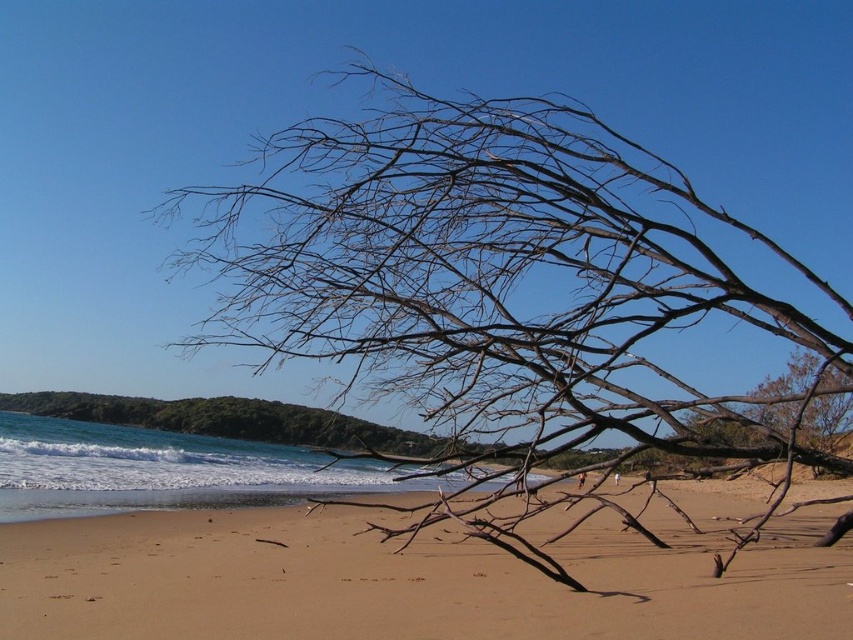
Question: Does brown/dry wood at center lie behind brown sandy beach at center?

Choices:
 (A) yes
 (B) no

Answer: (A)

Question: Among these objects, which one is nearest to the camera?

Choices:
 (A) brown/dry wood at center
 (B) brown sandy beach at center

Answer: (B)

Question: In this image, where is brown/dry wood at center located relative to brown sandy beach at center?

Choices:
 (A) left
 (B) right

Answer: (B)

Question: Is the position of brown/dry wood at center less distant than that of brown sandy beach at center?

Choices:
 (A) no
 (B) yes

Answer: (A)